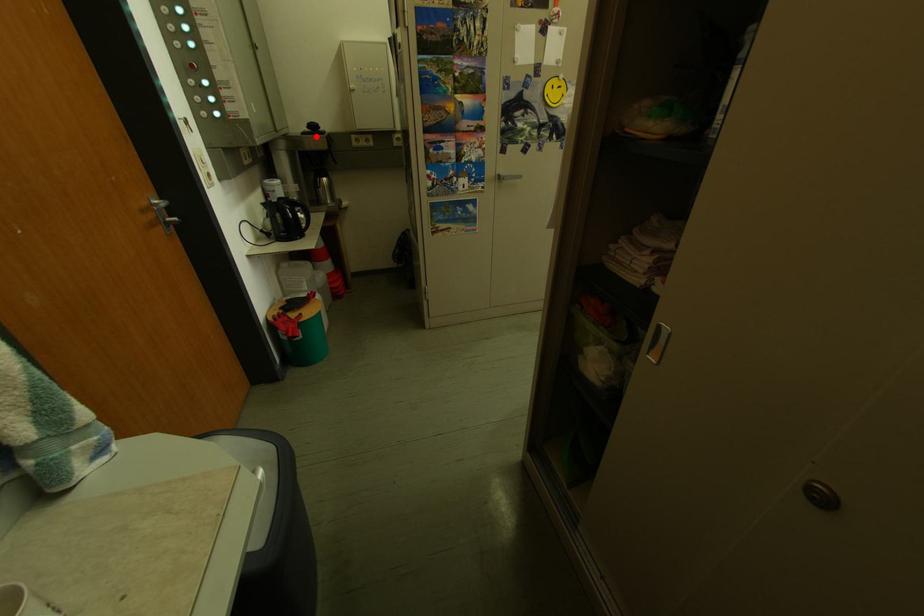
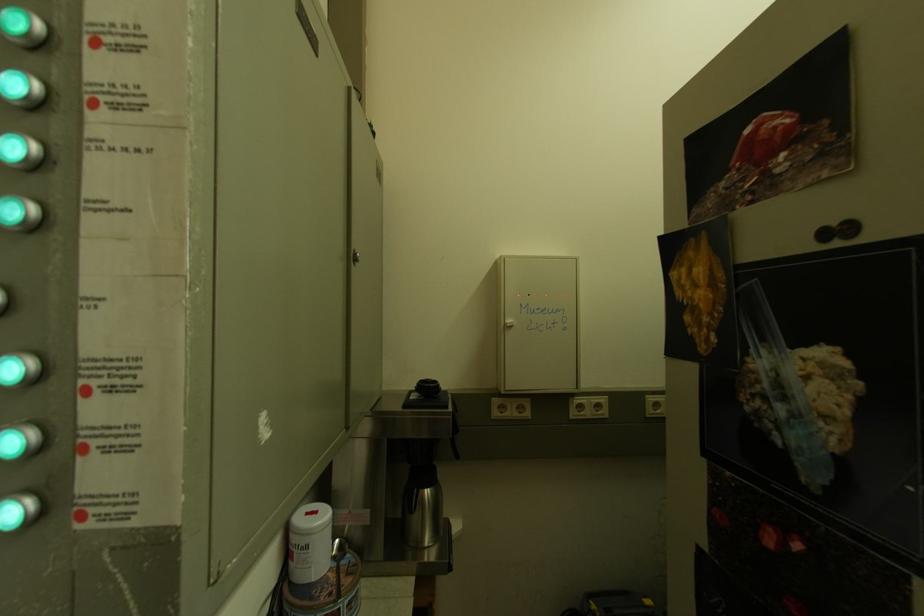
Question: I am providing you with two images of the same scene from different viewpoints. In image1, a red point is highlighted. Considering the same 3D point in image2, which of the following is correct?

Choices:
 (A) It is closer
 (B) It is farther

Answer: (B)